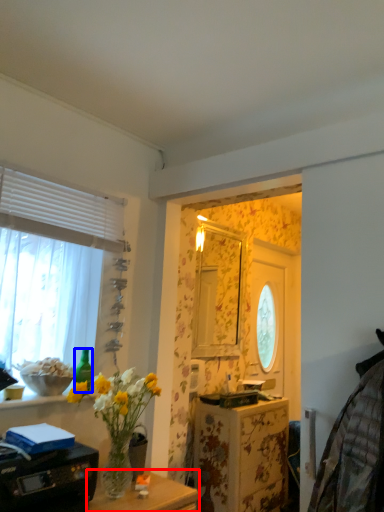
Question: Which point is closer to the camera, table (highlighted by a red box) or bottle (highlighted by a blue box)?

Choices:
 (A) table
 (B) bottle

Answer: (A)